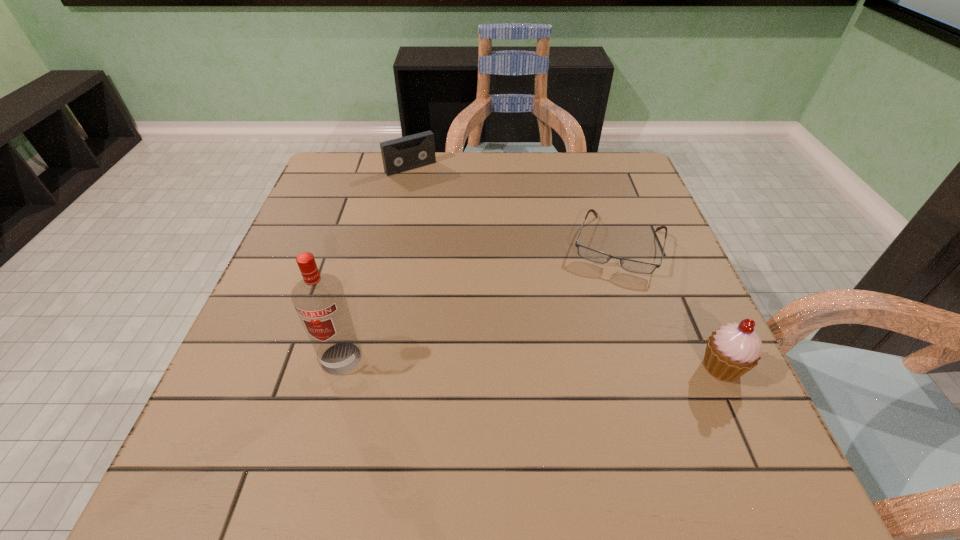
This screenshot has height=540, width=960. I want to click on vacant region located on the front-facing side of the spectacles, so click(592, 330).

Identify the location of vacant area situated 0.130m on the front-facing side of the second shortest object. (441, 198).

Identify the location of free space located 0.100m on the front-facing side of the second shortest object. This screenshot has width=960, height=540. (436, 193).

The width and height of the screenshot is (960, 540). What are the coordinates of `free space located 0.390m on the front-facing side of the second shortest object` in the screenshot? It's located at (488, 255).

This screenshot has width=960, height=540. Find the location of `object that is at the far edge`. object that is at the far edge is located at coordinates (398, 155).

Locate an element on the screen. The height and width of the screenshot is (540, 960). object present at the near edge is located at coordinates (731, 351).

Identify the location of object that is at the left edge. (319, 299).

I want to click on cupcake that is positioned at the right edge, so click(x=731, y=351).

The image size is (960, 540). What are the coordinates of `spectacles at the right edge` in the screenshot? It's located at (590, 254).

Where is `object located in the near right corner section of the desktop`? object located in the near right corner section of the desktop is located at coordinates (731, 351).